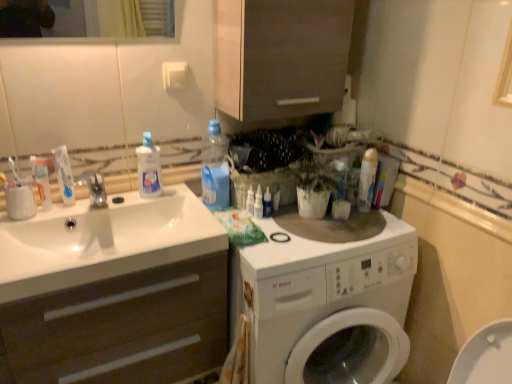
Where is `vacant area that is situated to the right of transparent plastic spray bottle at center, the 2th cleaning product when ordered from right to left`? The width and height of the screenshot is (512, 384). vacant area that is situated to the right of transparent plastic spray bottle at center, the 2th cleaning product when ordered from right to left is located at coordinates (306, 226).